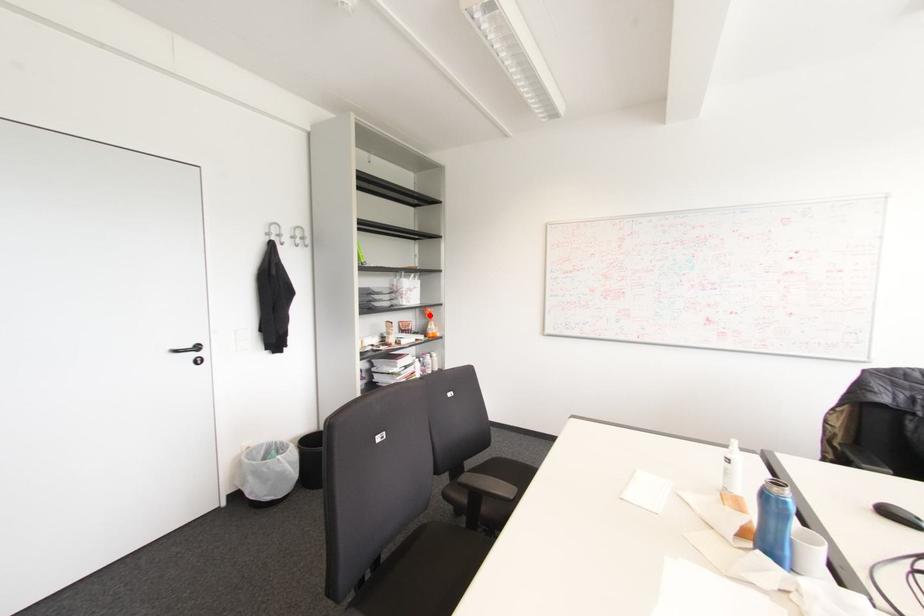
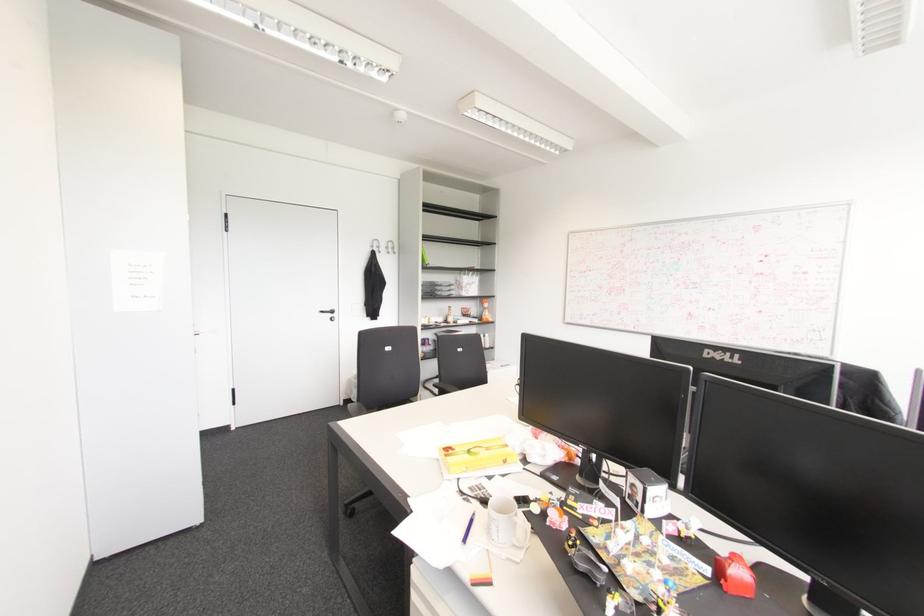
In the second image, find the point that corresponds to the highlighted location in the first image.

(485, 305)